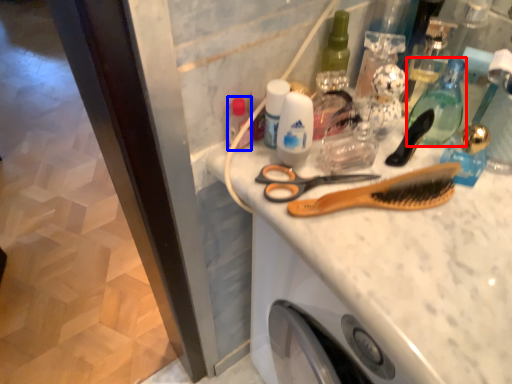
Question: Which object appears farthest to the camera in this image, mouthwash (highlighted by a red box) or toiletry (highlighted by a blue box)?

Choices:
 (A) mouthwash
 (B) toiletry

Answer: (B)